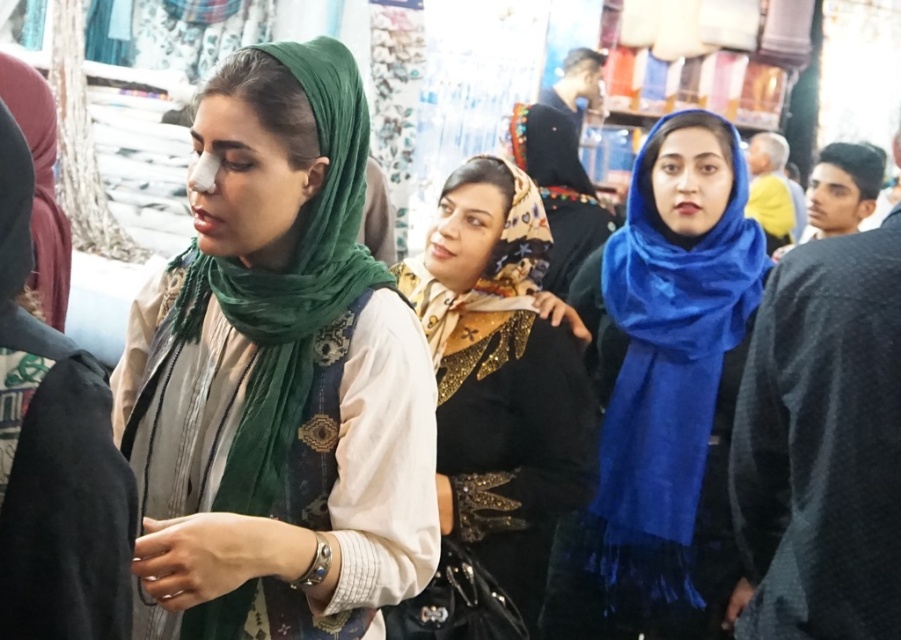
Question: Does shiny gold dress at center have a larger size compared to blue silk scarf at center?

Choices:
 (A) no
 (B) yes

Answer: (B)

Question: Which point is closer to the camera taking this photo?

Choices:
 (A) (579, 456)
 (B) (292, 112)

Answer: (B)

Question: Is shiny gold dress at center wider than blue silk scarf at center?

Choices:
 (A) yes
 (B) no

Answer: (A)

Question: Which of the following is the closest to the observer?

Choices:
 (A) (264, 221)
 (B) (669, 538)
 (C) (496, 524)

Answer: (A)

Question: Which object is the closest to the green silk scarf at center?

Choices:
 (A) shiny gold dress at center
 (B) blue silk scarf at center

Answer: (A)

Question: Is green silk scarf at center thinner than shiny gold dress at center?

Choices:
 (A) no
 (B) yes

Answer: (A)